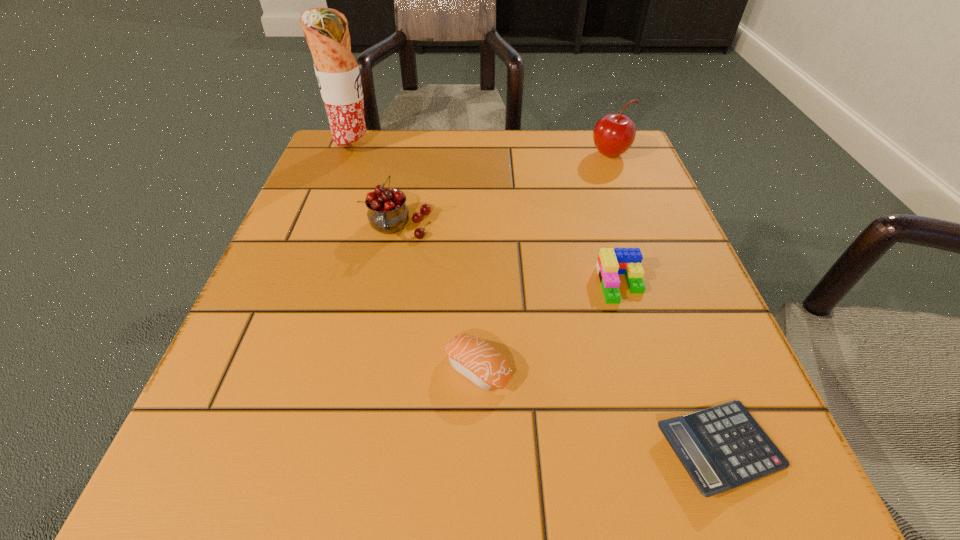
The image size is (960, 540). Find the location of `cherry that is at the left edge`. cherry that is at the left edge is located at coordinates (387, 213).

Find the location of a particular element. The image size is (960, 540). cherry located in the right edge section of the desktop is located at coordinates (613, 134).

Identify the location of Lego at the right edge. (611, 261).

The image size is (960, 540). I want to click on calculator at the right edge, so click(x=722, y=447).

This screenshot has width=960, height=540. Find the location of `object that is positioned at the far left corner`. object that is positioned at the far left corner is located at coordinates (326, 30).

This screenshot has height=540, width=960. What are the coordinates of `object situated at the far right corner` in the screenshot? It's located at (613, 134).

I want to click on object that is positioned at the near right corner, so click(722, 447).

Find the location of a particular element. vacant space at the far edge of the desktop is located at coordinates (408, 129).

At what (x,y) coordinates should I click in order to perform the action: click on free space at the left edge of the desktop. Please return your answer as a coordinate pair (x, y). This screenshot has height=540, width=960. Looking at the image, I should click on (271, 367).

Find the location of `vacant area at the right edge of the desktop`. vacant area at the right edge of the desktop is located at coordinates (629, 221).